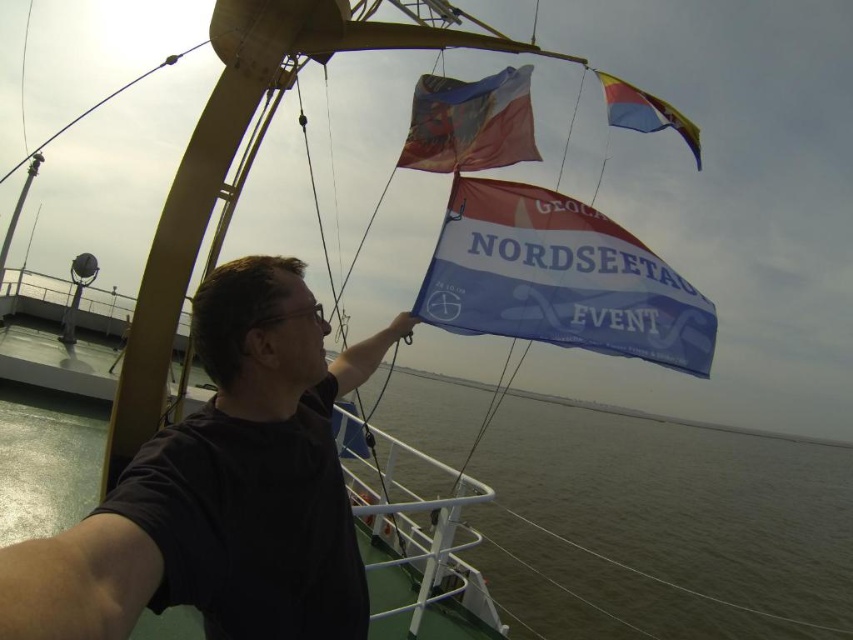
You are standing on the deck of the boat and want to reach the point marked at coordinates (437,273). If your reach extends 1.5 meters, can you touch that point without moving?

The point at coordinates (437,273) is 5.15 meters away from the viewer. Since your reach only extends 1.5 meters, you cannot touch that point without moving.

You are a photographer on the boat and want to capture both the multicolored fabric flag at upper center and the polyester flag at upper right in a single shot. Which flag will appear closer to the camera in the photo?

The multicolored fabric flag at upper center will appear closer to the camera because it is in front of the polyester flag at upper right.

You are a photographer on the boat and want to capture both the blue fabric flag at center and the multicolored fabric flag at upper center in a single photo. Which flag should you focus on first to ensure both are in frame?

The blue fabric flag at center is positioned under the multicolored fabric flag at upper center, so focusing on the multicolored fabric flag at upper center first will allow both to be captured in the frame.